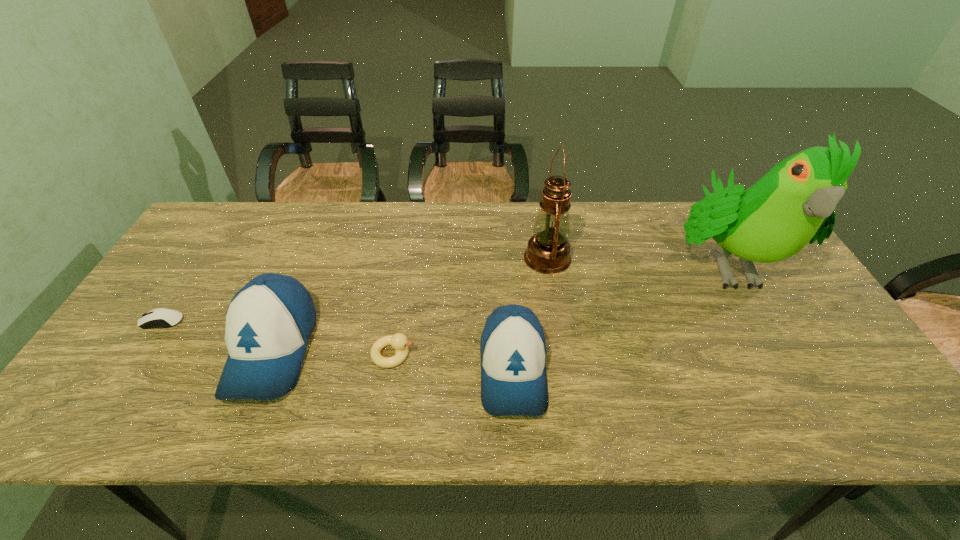
I want to click on object that is at the far right corner, so [x=794, y=203].

In the image, there is a desktop. Identify the location of vacant space at the far edge. The width and height of the screenshot is (960, 540). (326, 205).

In the image, there is a desktop. Identify the location of vacant space at the left edge. The image size is (960, 540). (157, 351).

Find the location of a particular element. Image resolution: width=960 pixels, height=540 pixels. blank space at the far left corner is located at coordinates coord(228,228).

You are a GUI agent. You are given a task and a screenshot of the screen. Output one action in this format:
    pyautogui.click(x=<x>, y=<y>)
    Task: Click on the free space at the near left corner
    The image size is (960, 540).
    Given the screenshot: What is the action you would take?
    pyautogui.click(x=114, y=388)

At what (x,y) coordinates should I click in order to perform the action: click on free space between the fifth shortest object and the tallest object. Please return your answer as a coordinate pair (x, y). Looking at the image, I should click on (636, 261).

The image size is (960, 540). Find the location of `vacant space in between the parakeet and the third tallest object`. vacant space in between the parakeet and the third tallest object is located at coordinates 499,307.

At what (x,y) coordinates should I click in order to perform the action: click on free spot between the rightmost object and the mouse. Please return your answer as a coordinate pair (x, y). This screenshot has width=960, height=540. Looking at the image, I should click on 444,293.

Locate an element on the screen. This screenshot has width=960, height=540. empty space between the fifth object from right to left and the shortest object is located at coordinates (218, 335).

The image size is (960, 540). In order to click on vacant area between the rightmost object and the oil lamp in this screenshot , I will do `click(636, 261)`.